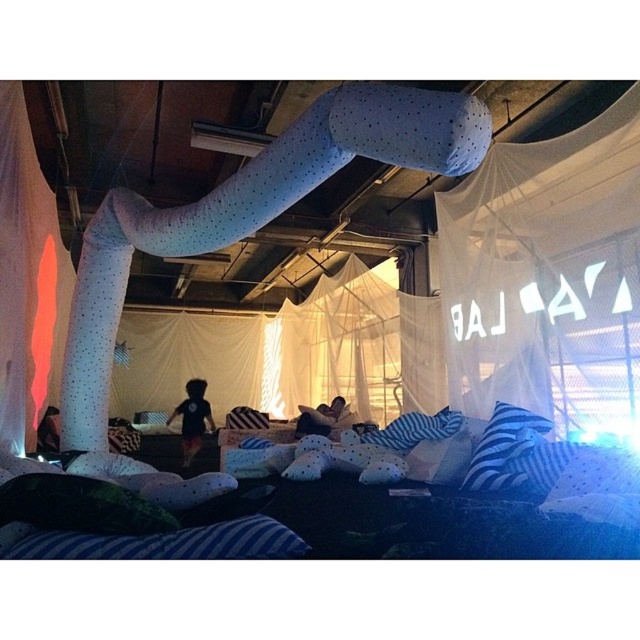
Does velvet green pillow at lower left have a lesser height compared to white dotted pillow at center?

Correct, velvet green pillow at lower left is not as tall as white dotted pillow at center.

Who is more forward, (54, 493) or (227, 428)?

Point (54, 493)

Who is more distant from viewer, (93, 509) or (230, 419)?

Point (230, 419)

At what (x,y) coordinates should I click in order to perform the action: click on velvet green pillow at lower left. Please return your answer as a coordinate pair (x, y). Looking at the image, I should click on (80, 506).

Does blue striped pillow at lower left have a greater width compared to blue striped pillow at center?

Indeed, blue striped pillow at lower left has a greater width compared to blue striped pillow at center.

Does point (172, 538) come closer to viewer compared to point (433, 433)?

Yes, it is.

What do you see at coordinates (164, 544) in the screenshot?
I see `blue striped pillow at lower left` at bounding box center [164, 544].

Locate an element on the screen. The width and height of the screenshot is (640, 640). blue striped pillow at lower left is located at coordinates (164, 544).

Is blue striped pillow at lower right above black plush bear at center?

Correct, blue striped pillow at lower right is located above black plush bear at center.

Is point (525, 445) farther from camera compared to point (192, 417)?

No, it is in front of (192, 417).

Is point (488, 461) positioned after point (204, 429)?

No.

Image resolution: width=640 pixels, height=640 pixels. I want to click on blue striped pillow at lower right, so click(x=502, y=448).